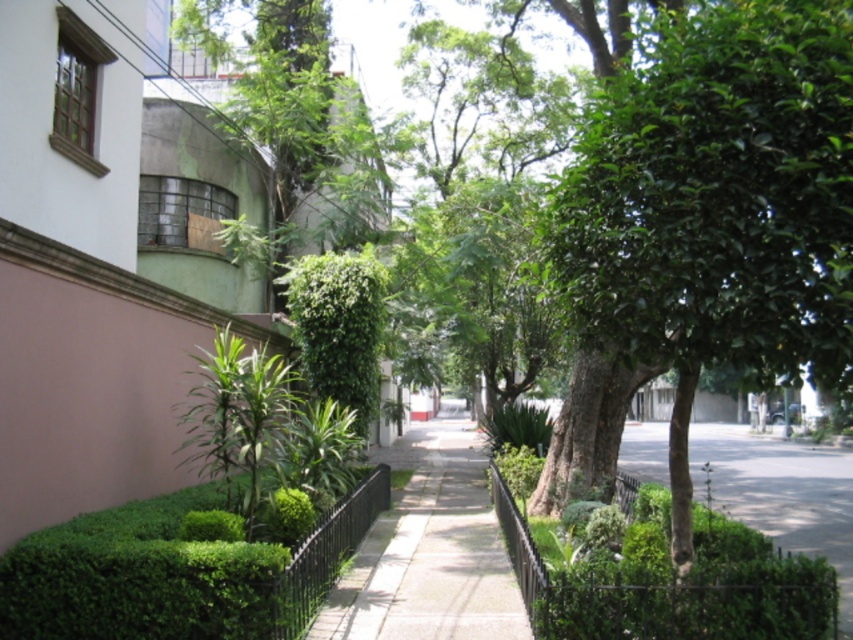
You are standing at the starting point in the urban street scene. There are two points marked as point 1 and point 2. Point 1 is located at coordinates point (126, 548) and point 2 is at point (490, 624). If you want to walk towards point 2, will point 1 be in your path?

Point 1 is in front of point 2, so walking towards point 2 would require passing by point 1 first, meaning point 1 is in your path.

You are walking along the sidewalk and want to take a photo of both the green leafy tree at center and the green leafy hedge at center. Which object should you focus on first to ensure both are in the frame?

You should focus on the green leafy tree at center first because it is larger than the green leafy hedge at center, so capturing it first ensures the smaller hedge will also fit in the frame.